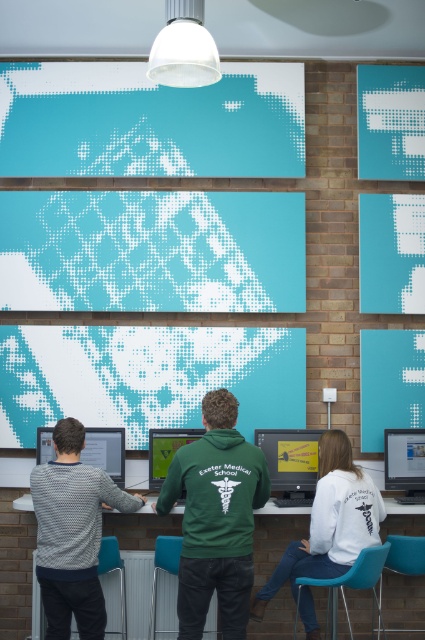
Is wooden table at center below matte yellow monitor at center?

Correct, wooden table at center is located below matte yellow monitor at center.

Which is more to the left, wooden table at center or matte yellow monitor at center?

Positioned to the left is matte yellow monitor at center.

Is point (20, 564) positioned in front of point (306, 456)?

That is False.

In order to click on wooden table at center in this screenshot , I will do `click(16, 564)`.

I want to click on matte black monitor at center, so 405,460.

Can you confirm if matte black monitor at center is shorter than matte black monitor at lower left?

In fact, matte black monitor at center may be taller than matte black monitor at lower left.

Find the location of `matte black monitor at center`. matte black monitor at center is located at coordinates (405, 460).

At what (x,y) coordinates should I click in order to perform the action: click on matte black monitor at center. Please return your answer as a coordinate pair (x, y). This screenshot has height=640, width=425. Looking at the image, I should click on (405, 460).

Can you confirm if wooden table at center is thinner than patterned sweater at left?

No, wooden table at center is not thinner than patterned sweater at left.

The image size is (425, 640). Describe the element at coordinates (16, 564) in the screenshot. I see `wooden table at center` at that location.

The height and width of the screenshot is (640, 425). In order to click on wooden table at center in this screenshot , I will do `click(16, 564)`.